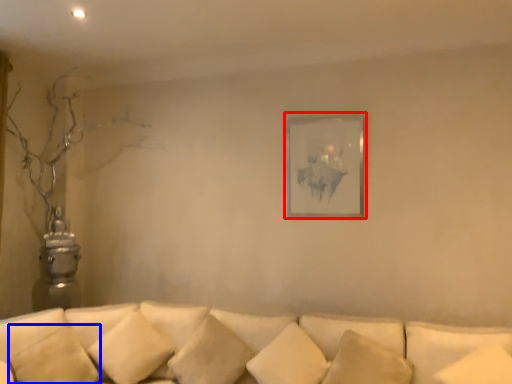
Question: Which object is further to the camera taking this photo, picture frame (highlighted by a red box) or pillow (highlighted by a blue box)?

Choices:
 (A) picture frame
 (B) pillow

Answer: (A)